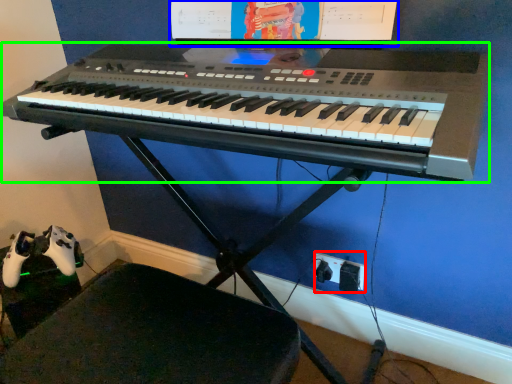
Question: Which object is positioned closest to plug (highlighted by a red box)? Select from computer monitor (highlighted by a blue box) and musical keyboard (highlighted by a green box).

Choices:
 (A) computer monitor
 (B) musical keyboard

Answer: (B)